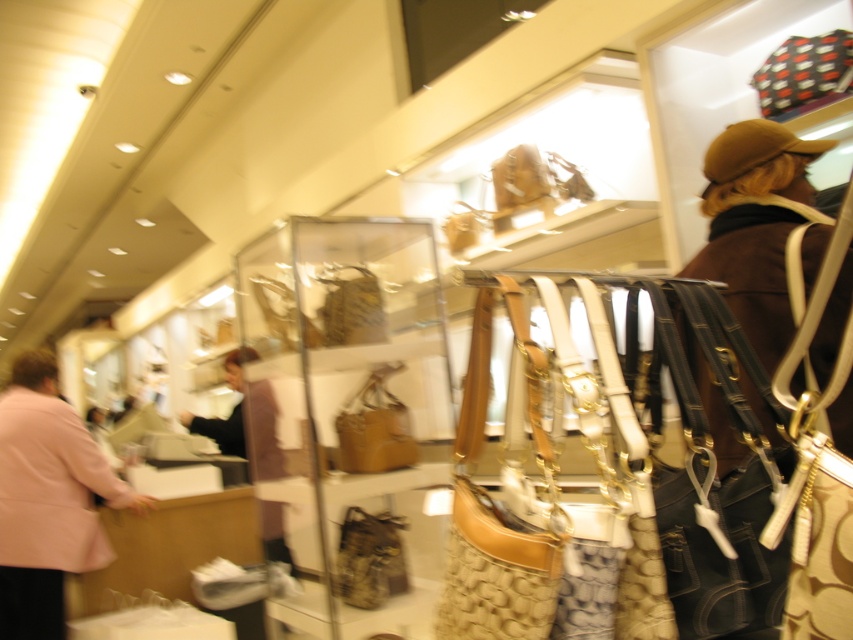
From the picture: Does pink fabric coat at left appear on the right side of leather bag at center?

Incorrect, pink fabric coat at left is not on the right side of leather bag at center.

Does pink fabric coat at left appear over leather bag at center?

Yes.

Is point (10, 529) positioned after point (390, 577)?

Yes, point (10, 529) is farther from viewer.

This screenshot has width=853, height=640. Identify the location of pink fabric coat at left. (47, 499).

Can you confirm if matte brown leather handbag at center is bigger than leather bag at center?

Yes, matte brown leather handbag at center is bigger than leather bag at center.

Can you confirm if matte brown leather handbag at center is smaller than leather bag at center?

Actually, matte brown leather handbag at center might be larger than leather bag at center.

Measure the distance between point (380, 416) and camera.

Point (380, 416) and camera are 8.74 feet apart.

Identify the location of matte brown leather handbag at center. (375, 428).

Based on the photo, does pink fabric coat at left appear on the right side of matte brown leather handbag at center?

No, pink fabric coat at left is not to the right of matte brown leather handbag at center.

Consider the image. Is pink fabric coat at left bigger than matte brown leather handbag at center?

Indeed, pink fabric coat at left has a larger size compared to matte brown leather handbag at center.

Is point (88, 433) positioned behind point (384, 460)?

Yes, it is behind point (384, 460).

Find the location of a particular element. pink fabric coat at left is located at coordinates (47, 499).